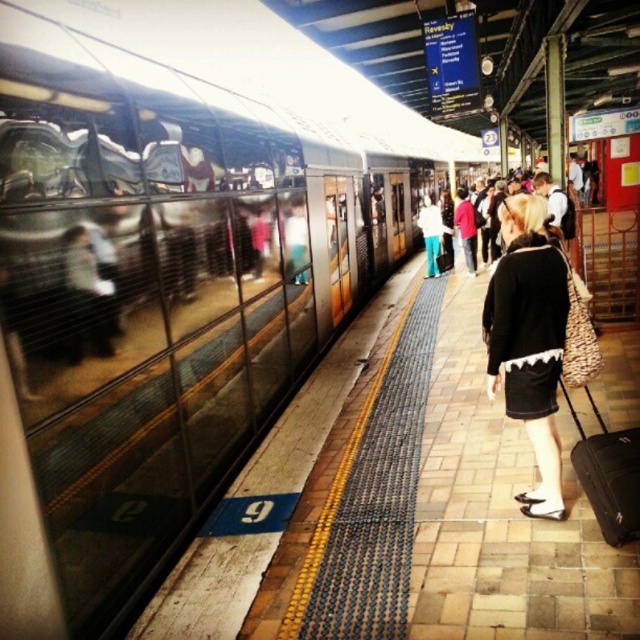
Which of these two, black matte skirt at center or black fabric suitcase at lower right, stands shorter?

black fabric suitcase at lower right

Locate an element on the screen. The image size is (640, 640). black matte skirt at center is located at coordinates (529, 339).